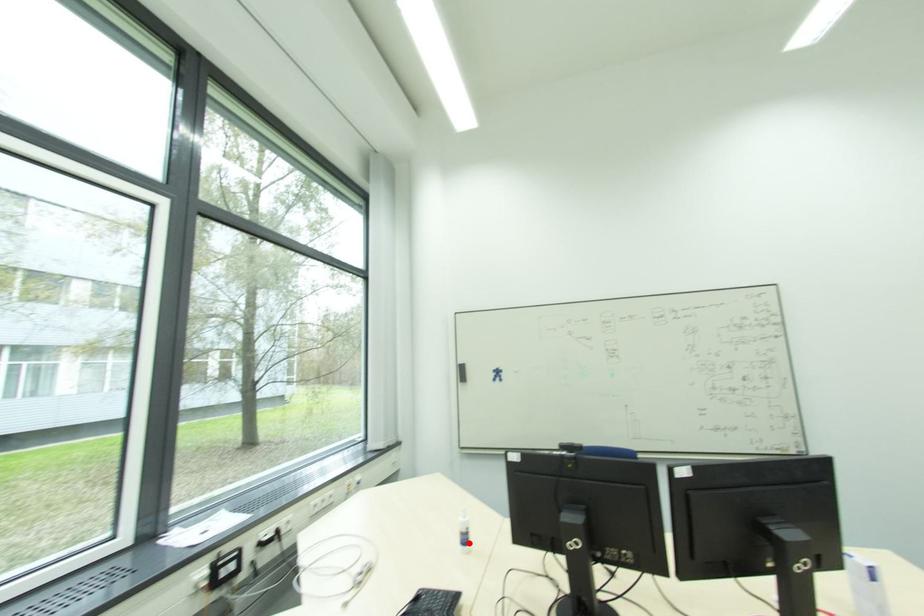
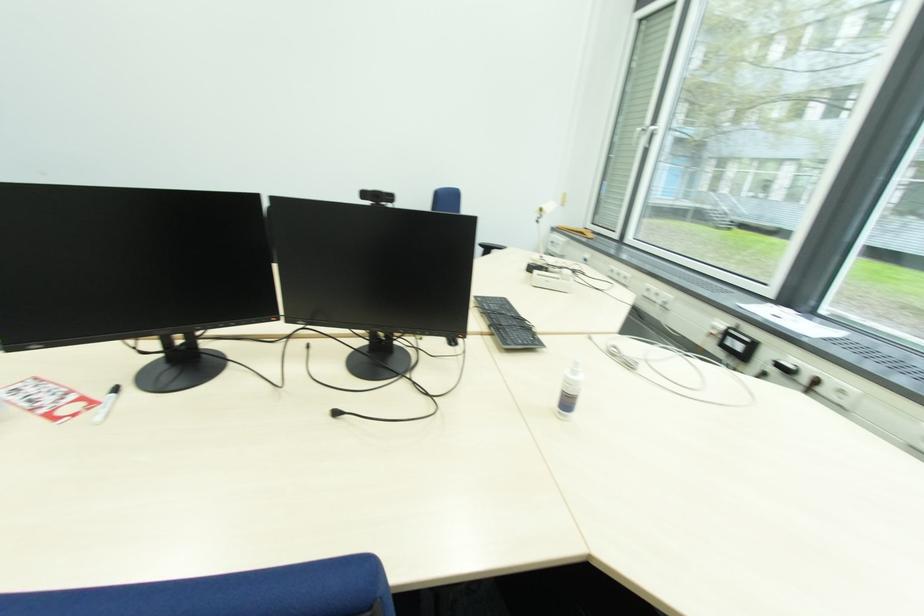
Question: I am providing you with two images of the same scene from different viewpoints. A red point is marked on the first image. At the location where the point appears in image 1, is it still visible in image 2?

Choices:
 (A) Yes
 (B) No

Answer: (A)